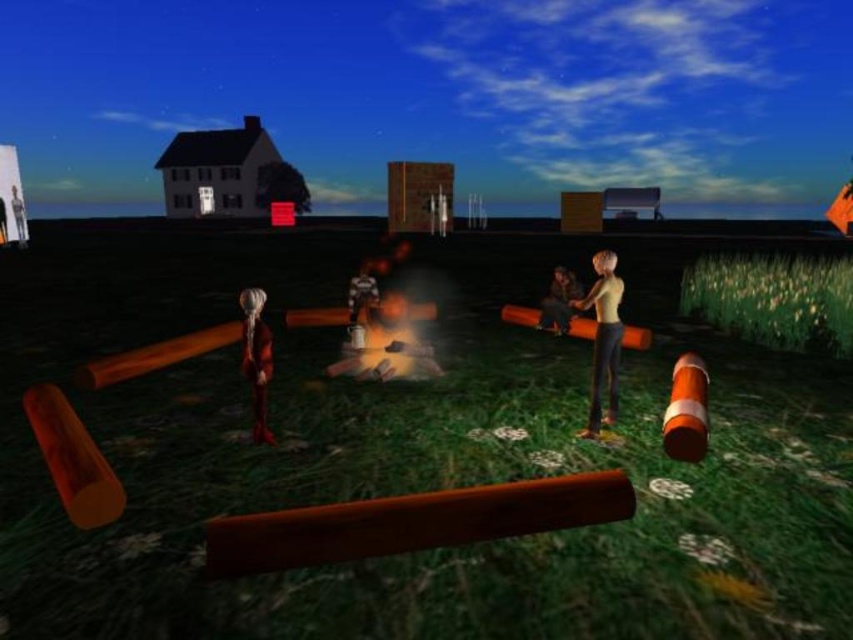
Can you confirm if leather jacket at center is bigger than shiny metallic figure at center?

Correct, leather jacket at center is larger in size than shiny metallic figure at center.

In the scene shown: Who is positioned more to the right, leather jacket at center or shiny metallic figure at center?

leather jacket at center is more to the right.

The width and height of the screenshot is (853, 640). What do you see at coordinates (560, 301) in the screenshot?
I see `leather jacket at center` at bounding box center [560, 301].

Where is `leather jacket at center`? This screenshot has width=853, height=640. leather jacket at center is located at coordinates (560, 301).

Who is positioned more to the left, smooth beige shirt at center right or shiny metallic figure at center?

shiny metallic figure at center is more to the left.

Does smooth beige shirt at center right have a greater width compared to shiny metallic figure at center?

Yes, smooth beige shirt at center right is wider than shiny metallic figure at center.

Locate an element on the screen. smooth beige shirt at center right is located at coordinates (602, 339).

The width and height of the screenshot is (853, 640). What are the coordinates of `smooth beige shirt at center right` in the screenshot? It's located at 602,339.

In the scene shown: Which is more to the left, shiny red dress at center or leather jacket at center?

shiny red dress at center

What do you see at coordinates (256, 356) in the screenshot? I see `shiny red dress at center` at bounding box center [256, 356].

Image resolution: width=853 pixels, height=640 pixels. What are the coordinates of `shiny red dress at center` in the screenshot? It's located at (256, 356).